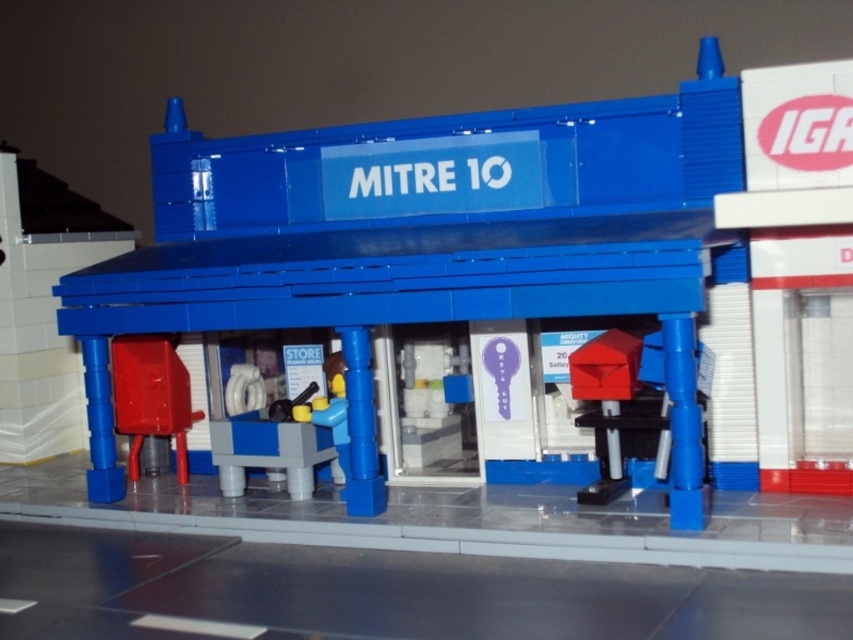
You are a delivery person who needs to place both the matte red toolbox at center and the matte red mailbox at center on a shelf that can only hold items up to 50 cm in width. Which item should you place first to ensure both fit?

The matte red toolbox at center is wider than the matte red mailbox at center. To ensure both fit on the shelf, place the wider matte red toolbox at center first, then the narrower matte red mailbox at center.

You are a delivery person who needs to place a large package in the Mitre 10 LEGO model. The package must fit vertically between the matte red toolbox at center and the matte red mailbox at center. Given that the package is 20 cm tall, can it fit vertically between them?

The matte red toolbox at center is much taller than the matte red mailbox at center. Since the package is 20 cm tall, it may not fit vertically between them if the height difference between the two objects exceeds 20 cm. Please check the exact height difference to confirm.

Consider the image. You are standing 5 feet away from the matte blue building at center. If you walk towards it for 3 feet, will you be able to touch it?

The matte blue building at center is 7.10 feet away from the viewer. After walking 3 feet towards it, you would be 5 feet minus 3 feet equals 2 feet away. Since 2 feet is still more than zero, you won not be able to touch it.